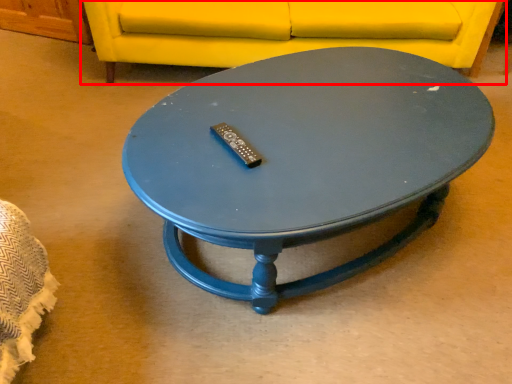
Question: From the image's perspective, what is the correct spatial relationship of studio couch (annotated by the red box) in relation to coffee table?

Choices:
 (A) below
 (B) above

Answer: (B)